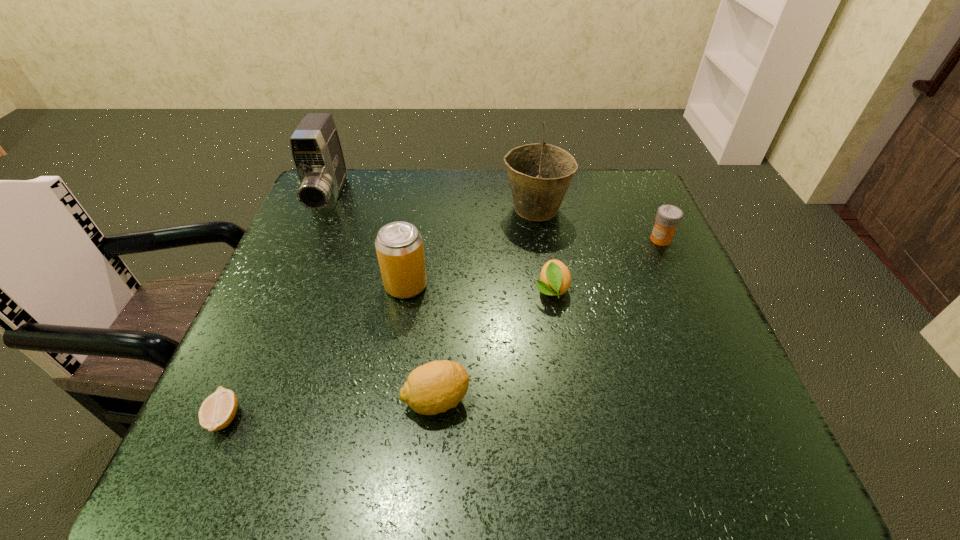
Locate an element on the screen. Image resolution: width=960 pixels, height=540 pixels. vacant space located on the front of the wine bucket is located at coordinates (545, 276).

Where is `free space located at the front of the camcorder, highlighting the lens`? The width and height of the screenshot is (960, 540). free space located at the front of the camcorder, highlighting the lens is located at coordinates (266, 350).

Where is `free spot located 0.130m on the back of the third tallest object`? The height and width of the screenshot is (540, 960). free spot located 0.130m on the back of the third tallest object is located at coordinates (415, 234).

Find the location of a particular element. The width and height of the screenshot is (960, 540). vacant space positioned 0.170m on the label side of the fifth nearest object is located at coordinates (579, 239).

Locate an element on the screen. Image resolution: width=960 pixels, height=540 pixels. free spot located on the label side of the fifth nearest object is located at coordinates (555, 239).

Locate an element on the screen. Image resolution: width=960 pixels, height=540 pixels. vacant space situated 0.350m on the label side of the fifth nearest object is located at coordinates (505, 239).

What are the coordinates of `free space located 0.280m at the stem end of the second lemon from right to left` in the screenshot? It's located at (631, 400).

Identify the location of blank area located 0.140m with leaves positioned above the second shortest object. This screenshot has height=540, width=960. (564, 366).

Where is `free space located on the back of the shortest object`? free space located on the back of the shortest object is located at coordinates (251, 357).

Find the location of a particular element. This screenshot has width=960, height=540. wine bucket present at the far edge is located at coordinates tap(540, 174).